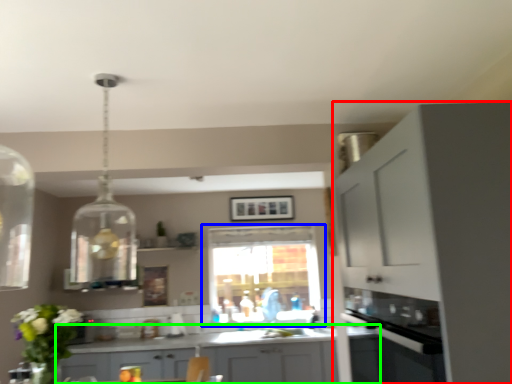
Question: Considering the real-world distances, which object is closest to cabinetry (highlighted by a red box)? window (highlighted by a blue box) or cabinetry (highlighted by a green box).

Choices:
 (A) window
 (B) cabinetry

Answer: (B)